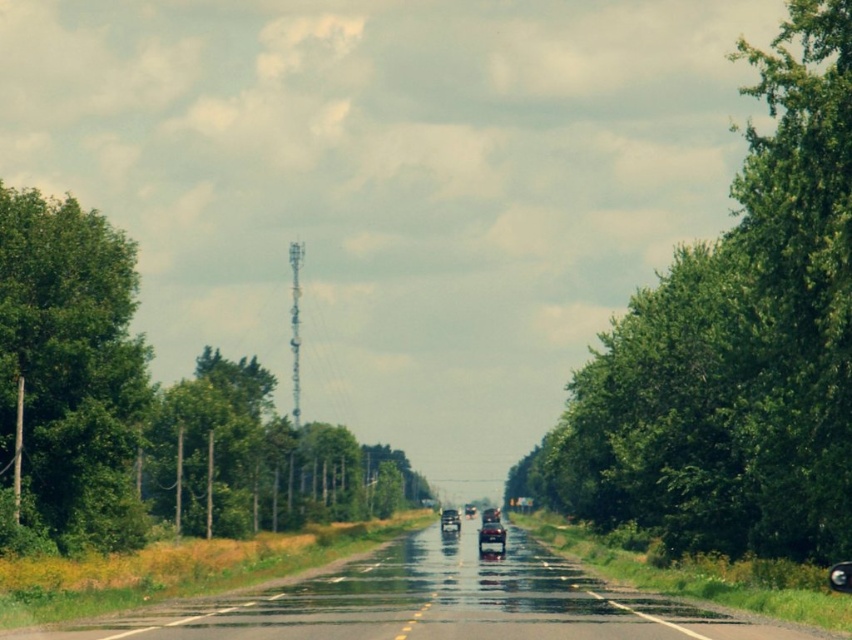
Is the position of green leafy tree at left more distant than that of shiny silver car at center?

No.

Where is `green leafy tree at left`? Image resolution: width=852 pixels, height=640 pixels. green leafy tree at left is located at coordinates (67, 376).

Does green leafy tree at center have a lesser height compared to shiny silver car at center?

No.

You are a GUI agent. You are given a task and a screenshot of the screen. Output one action in this format:
    pyautogui.click(x=<x>, y=<y>)
    Task: Click on the green leafy tree at center
    
    Given the screenshot: What is the action you would take?
    pyautogui.click(x=137, y=410)

In order to click on green leafy tree at center in this screenshot , I will do `click(137, 410)`.

Consider the image. Can you confirm if green leafy tree at right is positioned to the right of green leafy tree at center?

Correct, you'll find green leafy tree at right to the right of green leafy tree at center.

Between point (630, 460) and point (283, 497), which one is positioned in front?

Point (630, 460) is more forward.

What do you see at coordinates (735, 344) in the screenshot?
I see `green leafy tree at right` at bounding box center [735, 344].

Identify the location of green leafy tree at right. This screenshot has height=640, width=852. (735, 344).